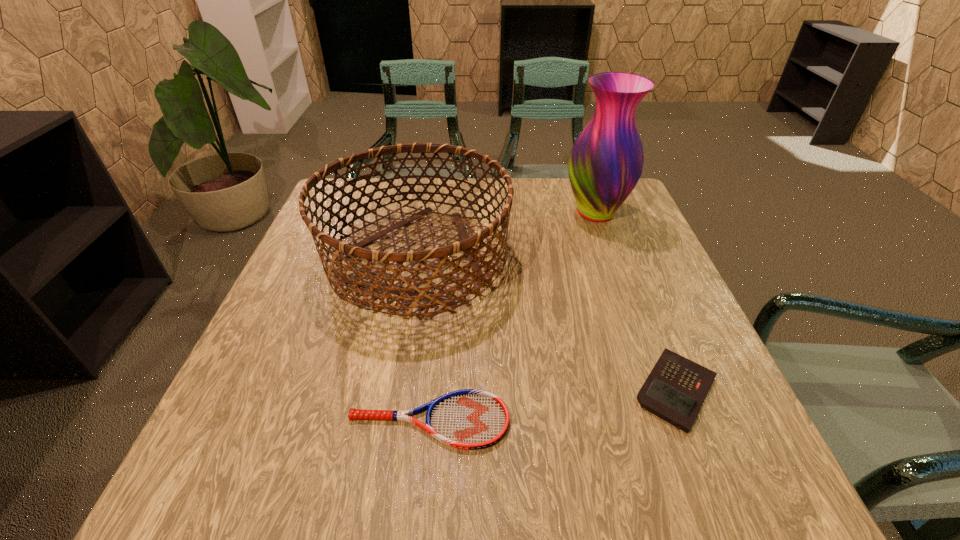
Image resolution: width=960 pixels, height=540 pixels. I want to click on object that is at the near edge, so click(470, 419).

I want to click on object located at the left edge, so coord(342,250).

You are a GUI agent. You are given a task and a screenshot of the screen. Output one action in this format:
    pyautogui.click(x=<x>, y=<y>)
    Task: Click on the vase that is at the right edge
    
    Given the screenshot: What is the action you would take?
    pyautogui.click(x=606, y=161)

Image resolution: width=960 pixels, height=540 pixels. I want to click on calculator present at the right edge, so click(x=675, y=390).

Image resolution: width=960 pixels, height=540 pixels. Find the location of `object at the far left corner`. object at the far left corner is located at coordinates (342, 250).

This screenshot has width=960, height=540. In order to click on object situated at the far right corner in this screenshot , I will do coord(606,161).

The width and height of the screenshot is (960, 540). I want to click on vacant area at the far edge, so click(x=461, y=192).

Find the location of a particular element. The image size is (960, 540). free region at the left edge is located at coordinates (371, 226).

Where is `free space at the right edge of the desktop`? Image resolution: width=960 pixels, height=540 pixels. free space at the right edge of the desktop is located at coordinates (642, 319).

You are a GUI agent. You are given a task and a screenshot of the screen. Output one action in this format:
    pyautogui.click(x=<x>, y=<y>)
    Task: Click on the vacant region at the far left corner of the desktop
    
    Given the screenshot: What is the action you would take?
    pyautogui.click(x=318, y=215)